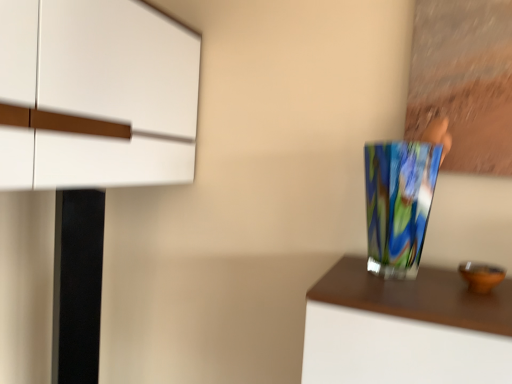
Question: Do you think multicolored glass vase at right is within white matte cabinet at upper left, or outside of it?

Choices:
 (A) outside
 (B) inside

Answer: (A)

Question: Based on their positions, is multicolored glass vase at right located to the left or right of white matte cabinet at upper left?

Choices:
 (A) left
 (B) right

Answer: (B)

Question: Is multicolored glass vase at right taller or shorter than white matte cabinet at upper left?

Choices:
 (A) tall
 (B) short

Answer: (B)

Question: Considering the positions of point (51, 160) and point (401, 193), is point (51, 160) closer or farther from the camera than point (401, 193)?

Choices:
 (A) closer
 (B) farther

Answer: (A)

Question: Would you say white matte cabinet at upper left is to the left or to the right of multicolored glass vase at right in the picture?

Choices:
 (A) right
 (B) left

Answer: (B)

Question: From a real-world perspective, is white matte cabinet at upper left physically located above or below multicolored glass vase at right?

Choices:
 (A) below
 (B) above

Answer: (B)

Question: From their relative heights in the image, would you say white matte cabinet at upper left is taller or shorter than multicolored glass vase at right?

Choices:
 (A) short
 (B) tall

Answer: (B)